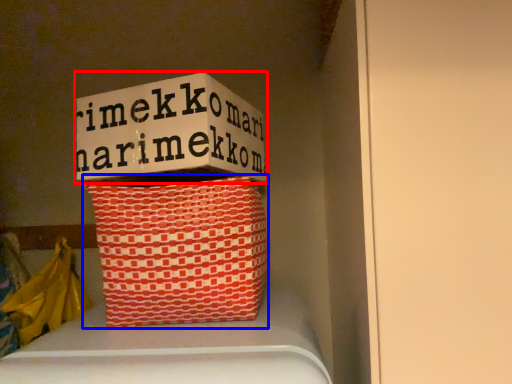
Question: Which object is closer to the camera taking this photo, box (highlighted by a red box) or basket (highlighted by a blue box)?

Choices:
 (A) box
 (B) basket

Answer: (B)